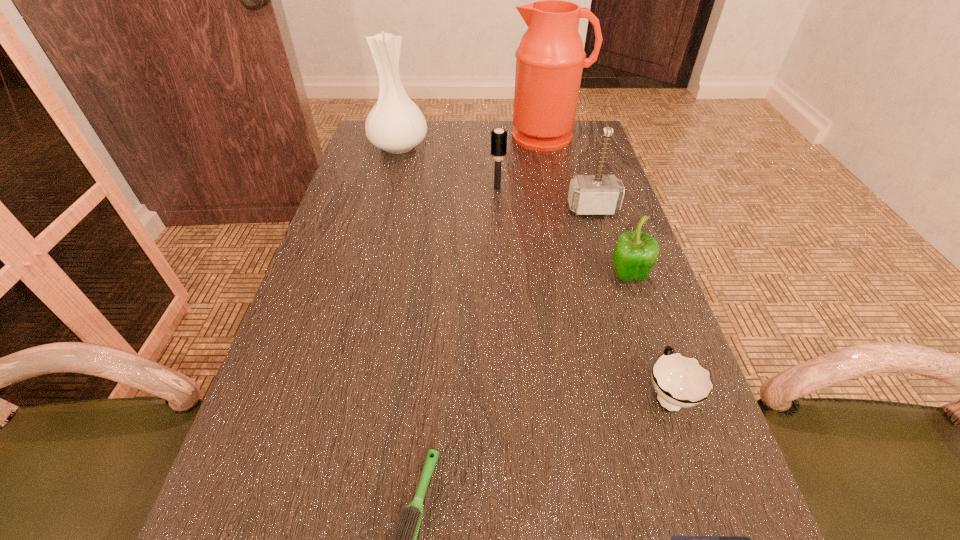
Locate an element on the screen. The width and height of the screenshot is (960, 540). vase that is positioned at the far edge is located at coordinates [x=395, y=124].

The height and width of the screenshot is (540, 960). I want to click on object that is at the left edge, so click(395, 124).

You are a GUI agent. You are given a task and a screenshot of the screen. Output one action in this format:
    pyautogui.click(x=<x>, y=<y>)
    Task: Click on the water jug present at the right edge
    The image size is (960, 540).
    Given the screenshot: What is the action you would take?
    pyautogui.click(x=550, y=59)

Where is `hammer that is at the right edge`? The width and height of the screenshot is (960, 540). hammer that is at the right edge is located at coordinates (599, 194).

Where is `bell pepper that is positioned at the right edge`? This screenshot has width=960, height=540. bell pepper that is positioned at the right edge is located at coordinates [x=635, y=253].

Identify the location of cup situated at the right edge. This screenshot has width=960, height=540. (680, 382).

Locate an element on the screen. object that is at the far left corner is located at coordinates (395, 124).

At what (x,y) coordinates should I click in order to perform the action: click on object positioned at the far right corner. Please return your answer as a coordinate pair (x, y). Looking at the image, I should click on (550, 59).

The width and height of the screenshot is (960, 540). In the image, there is a desktop. Find the location of `free region at the far edge`. free region at the far edge is located at coordinates (492, 126).

Identify the location of vacant space at the left edge of the desktop. (346, 280).